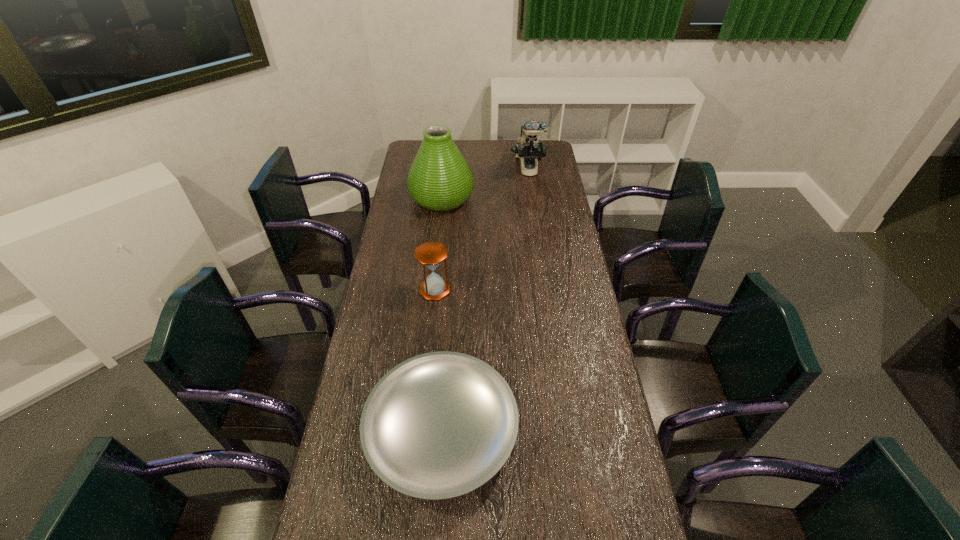
Locate an element on the screen. vase is located at coordinates (440, 179).

Locate an element on the screen. microscope is located at coordinates (528, 149).

I want to click on hourglass, so [430, 254].

This screenshot has width=960, height=540. Identify the location of the second shortest object. [430, 254].

The height and width of the screenshot is (540, 960). I want to click on the shortest object, so click(439, 425).

I want to click on the nearest object, so click(439, 425).

At what (x,y) coordinates should I click in order to perform the action: click on vacant region located on the back of the vase. Please return your answer as a coordinate pair (x, y). The height and width of the screenshot is (540, 960). Looking at the image, I should click on (445, 165).

Locate an element on the screen. Image resolution: width=960 pixels, height=540 pixels. vacant space situated through the eyepieces of the microscope is located at coordinates (537, 226).

You are a GUI agent. You are given a task and a screenshot of the screen. Output one action in this format:
    pyautogui.click(x=<x>, y=<y>)
    Task: Click on the free space located on the front of the third farthest object
    Image resolution: width=960 pixels, height=540 pixels.
    Given the screenshot: What is the action you would take?
    pyautogui.click(x=430, y=340)

The height and width of the screenshot is (540, 960). What are the coordinates of `vacant space situated on the right of the nearest object` in the screenshot? It's located at (596, 431).